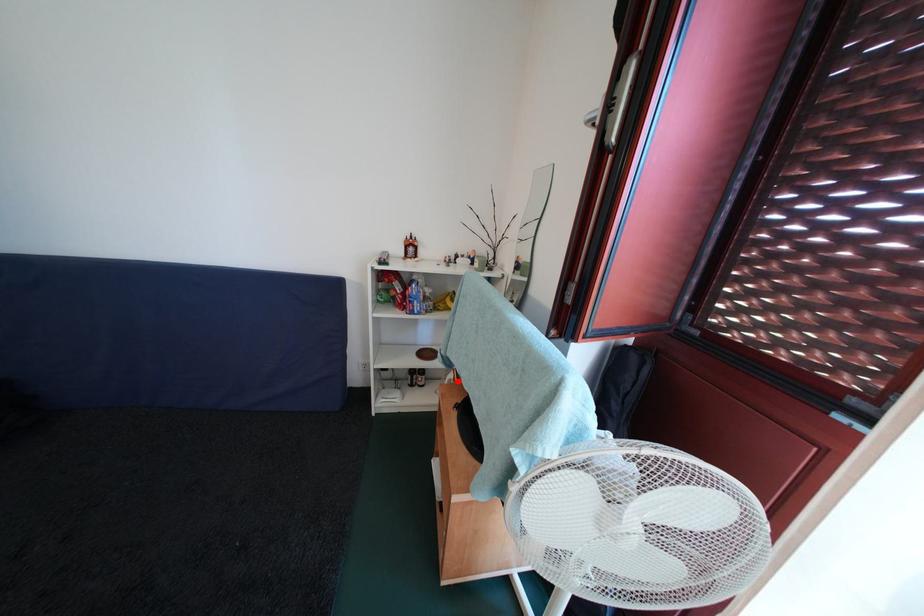
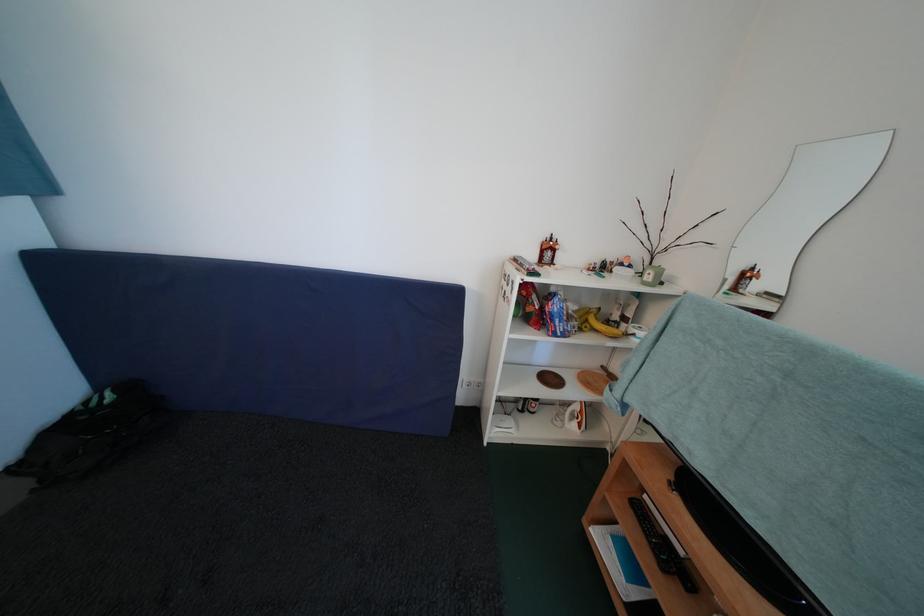
Question: A red point is marked in image1. In image2, is the corresponding 3D point closer to the camera or farther? Reply with the corresponding letter.

Choices:
 (A) The corresponding 3D point is closer.
 (B) The corresponding 3D point is farther.

Answer: (A)